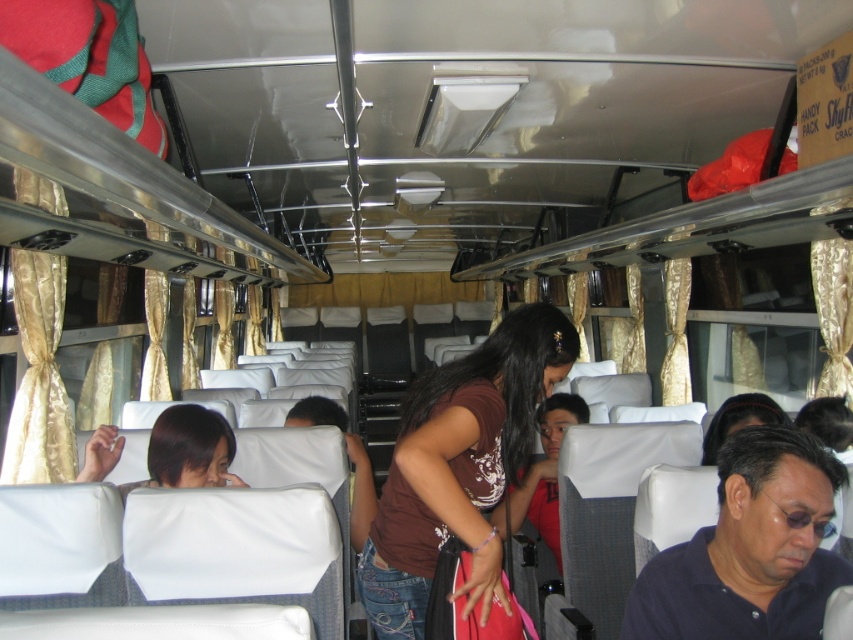
Question: Which of the following is the closest to the observer?

Choices:
 (A) brown fabric shirt at center
 (B) brown matte shirt at center

Answer: (B)

Question: Can you confirm if brown matte shirt at center is positioned above dark blue shirt at lower right?

Choices:
 (A) yes
 (B) no

Answer: (A)

Question: Can you confirm if brown matte shirt at center is smaller than dark blue shirt at lower right?

Choices:
 (A) no
 (B) yes

Answer: (A)

Question: From the image, what is the correct spatial relationship of dark blue shirt at lower right in relation to brown fabric shirt at center?

Choices:
 (A) left
 (B) right

Answer: (B)

Question: Which object is positioned closest to the dark blue shirt at lower right?

Choices:
 (A) brown fabric shirt at center
 (B) brown matte shirt at center

Answer: (B)

Question: Which of the following is the farthest from the observer?

Choices:
 (A) (538, 426)
 (B) (519, 392)

Answer: (A)